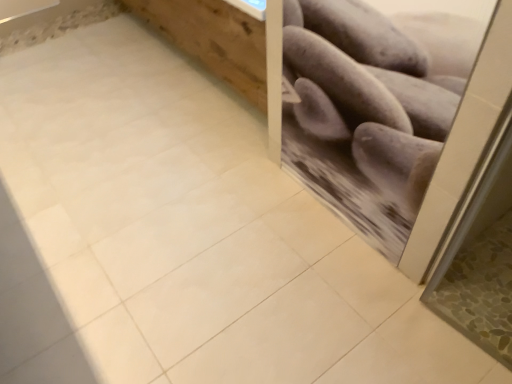
Question: Should I look upward or downward to see gray matte potatoes at upper right?

Choices:
 (A) up
 (B) down

Answer: (A)